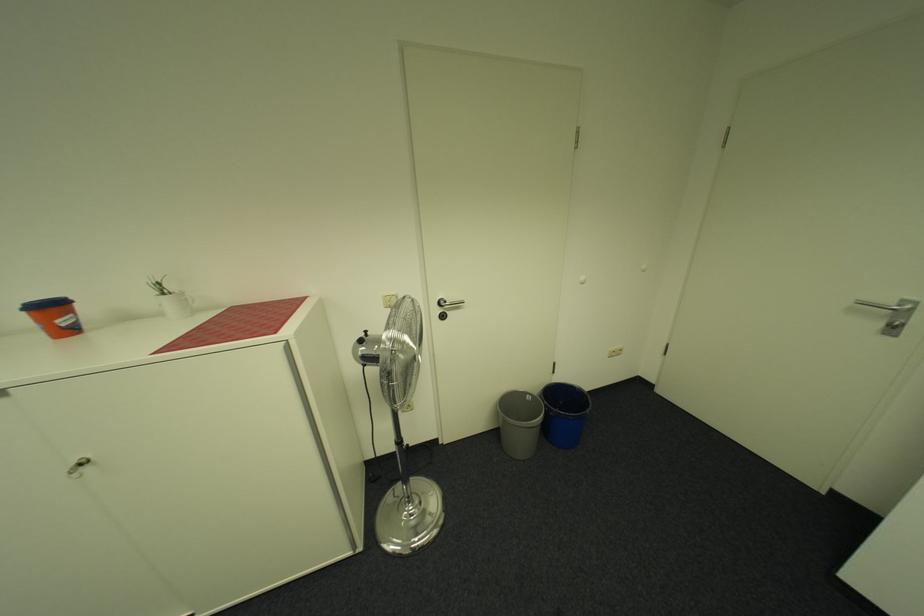
What do you see at coordinates (368, 336) in the screenshot? I see `a fan oscillation pin` at bounding box center [368, 336].